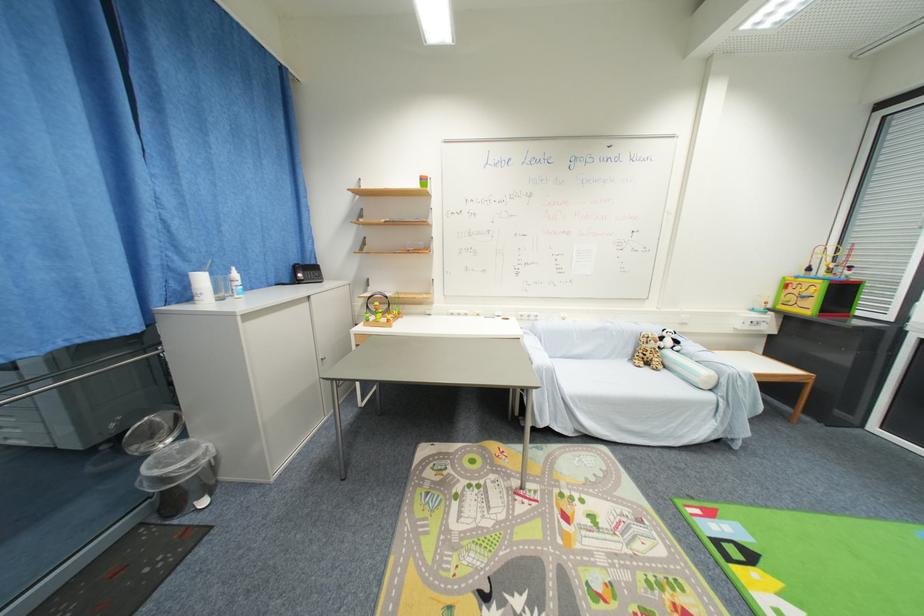
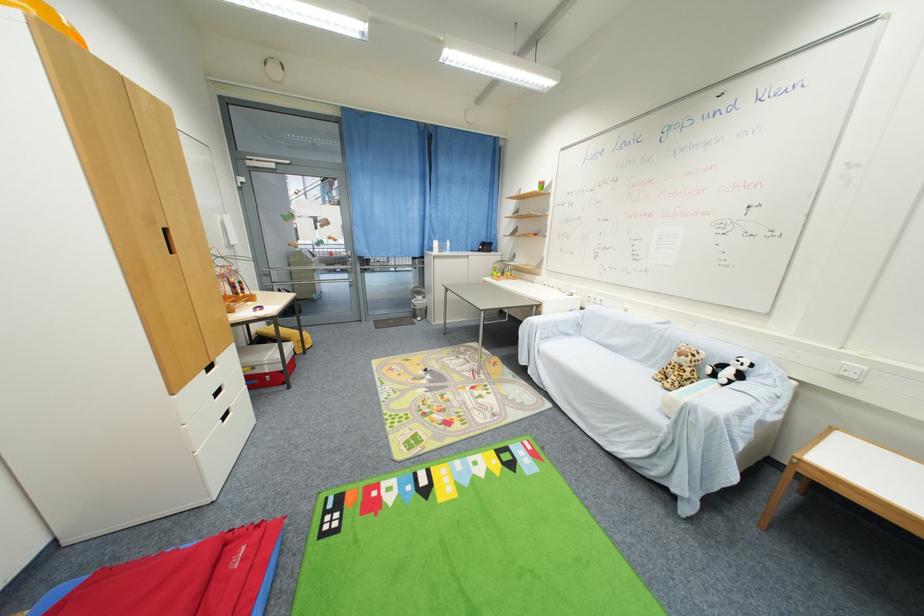
Locate, in the second image, the point that corresponds to point (660, 365) in the first image.

(675, 382)